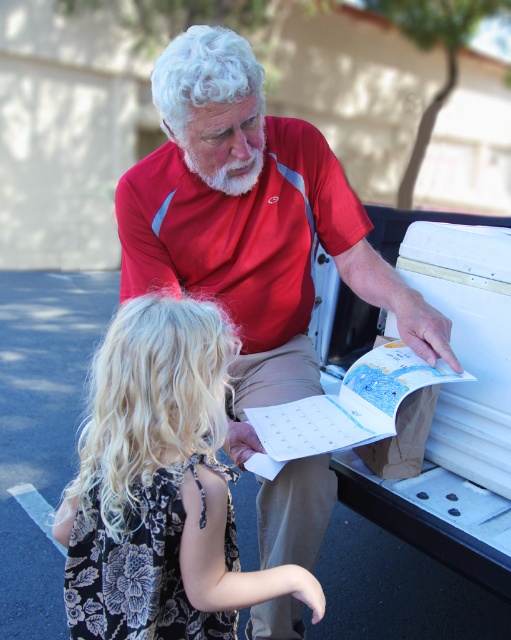
Question: Can you confirm if red matte shirt at upper center is positioned below whitehairbeard at center?

Choices:
 (A) no
 (B) yes

Answer: (B)

Question: Can you confirm if black floral dress at lower left is bigger than red polyester polo shirt at upper center?

Choices:
 (A) yes
 (B) no

Answer: (A)

Question: Which of the following is the farthest from the observer?

Choices:
 (A) red matte shirt at upper center
 (B) black floral dress at lower left
 (C) whitehairbeard at center
 (D) red polyester polo shirt at upper center

Answer: (D)

Question: Estimate the real-world distances between objects in this image. Which object is closer to the black floral dress at lower left?

Choices:
 (A) red polyester polo shirt at upper center
 (B) red matte shirt at upper center
 (C) whitehairbeard at center

Answer: (B)

Question: Does red matte shirt at upper center appear on the left side of whitehairbeard at center?

Choices:
 (A) yes
 (B) no

Answer: (B)

Question: Which of the following is the closest to the observer?

Choices:
 (A) (234, 179)
 (B) (111, 499)
 (C) (133, 282)

Answer: (B)